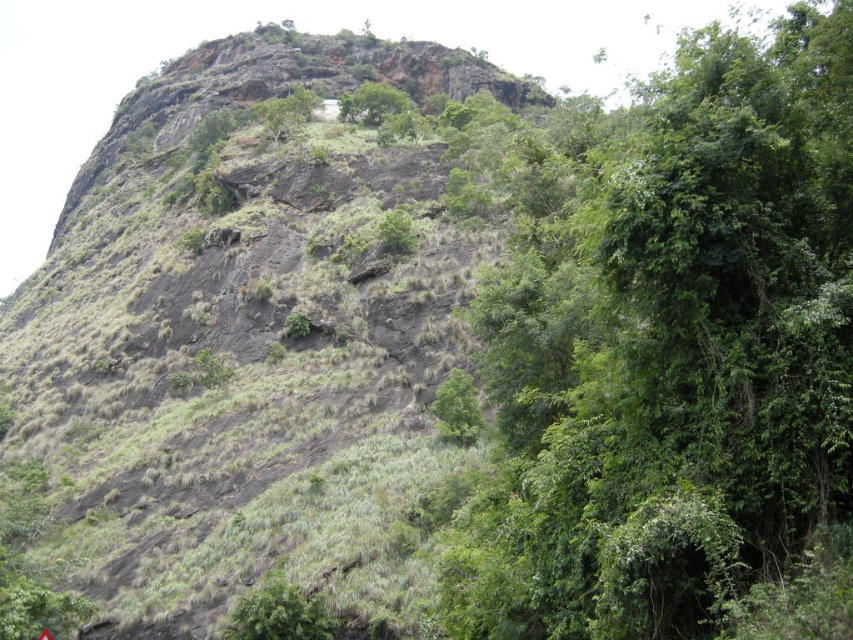
Find the location of a particular element. This screenshot has width=853, height=640. rugged rock mountain at upper left is located at coordinates (242, 346).

What do you see at coordinates (242, 346) in the screenshot? I see `rugged rock mountain at upper left` at bounding box center [242, 346].

The width and height of the screenshot is (853, 640). I want to click on rugged rock mountain at upper left, so click(242, 346).

Is rugged rock mountain at upper left positioned before green leafy tree at lower center?

That is True.

Which is more to the left, rugged rock mountain at upper left or green leafy tree at lower center?

rugged rock mountain at upper left is more to the left.

Does point (221, 388) come in front of point (238, 628)?

No, it is behind (238, 628).

Identify the location of rugged rock mountain at upper left. (242, 346).

Which of these two, green leafy tree at upper right or green leafy tree at upper center, stands shorter?

green leafy tree at upper center is shorter.

Which is below, green leafy tree at upper right or green leafy tree at upper center?

Positioned lower is green leafy tree at upper right.

Who is more forward, (555,534) or (399,106)?

Point (555,534) is in front.

You are a GUI agent. You are given a task and a screenshot of the screen. Output one action in this format:
    pyautogui.click(x=<x>, y=<y>)
    Task: Click on the green leafy tree at upper right
    Image resolution: width=853 pixels, height=640 pixels.
    Given the screenshot: What is the action you would take?
    pyautogui.click(x=669, y=348)